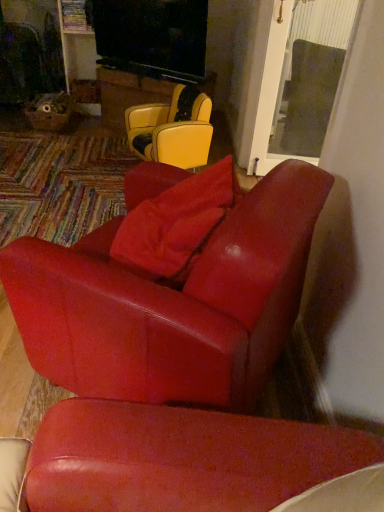
Question: Is leather yellow chair at center, which appears as the 1th chair when viewed from the back, wider than transparent glass door at upper right?

Choices:
 (A) yes
 (B) no

Answer: (B)

Question: Considering the relative sizes of leather yellow chair at center, the first chair positioned from the top, and transparent glass door at upper right in the image provided, is leather yellow chair at center, the first chair positioned from the top, bigger than transparent glass door at upper right?

Choices:
 (A) no
 (B) yes

Answer: (A)

Question: Is leather yellow chair at center, the first chair positioned from the top, taller than transparent glass door at upper right?

Choices:
 (A) yes
 (B) no

Answer: (B)

Question: Are leather yellow chair at center, the 2th chair positioned from the bottom, and transparent glass door at upper right beside each other?

Choices:
 (A) no
 (B) yes

Answer: (A)

Question: Does leather yellow chair at center, arranged as the second chair when viewed from the front, contain transparent glass door at upper right?

Choices:
 (A) no
 (B) yes

Answer: (A)

Question: Does point (168, 119) appear closer or farther from the camera than point (319, 128)?

Choices:
 (A) closer
 (B) farther

Answer: (A)

Question: In terms of size, does leather yellow chair at center, arranged as the second chair when viewed from the front, appear bigger or smaller than transparent glass door at upper right?

Choices:
 (A) big
 (B) small

Answer: (B)

Question: In the image, is leather yellow chair at center, the 2th chair positioned from the bottom, positioned in front of or behind transparent glass door at upper right?

Choices:
 (A) front
 (B) behind

Answer: (A)

Question: Is leather yellow chair at center, the 2th chair positioned from the bottom, inside or outside of transparent glass door at upper right?

Choices:
 (A) outside
 (B) inside

Answer: (A)

Question: Does point (165, 253) appear closer or farther from the camera than point (162, 154)?

Choices:
 (A) closer
 (B) farther

Answer: (A)

Question: Relative to leather yellow chair at center, which appears as the 1th chair when viewed from the back, is satin red pillow at center in front or behind?

Choices:
 (A) front
 (B) behind

Answer: (A)

Question: Is satin red pillow at center taller or shorter than leather yellow chair at center, which appears as the 1th chair when viewed from the back?

Choices:
 (A) tall
 (B) short

Answer: (B)

Question: Looking at their shapes, would you say satin red pillow at center is wider or thinner than leather yellow chair at center, the first chair positioned from the top?

Choices:
 (A) thin
 (B) wide

Answer: (A)

Question: Considering the positions of point (132, 131) and point (31, 310), is point (132, 131) closer or farther from the camera than point (31, 310)?

Choices:
 (A) farther
 (B) closer

Answer: (A)

Question: In terms of size, does leather yellow chair at center, arranged as the second chair when viewed from the front, appear bigger or smaller than matte red leather chair at center, which is the 2th chair from back to front?

Choices:
 (A) big
 (B) small

Answer: (B)